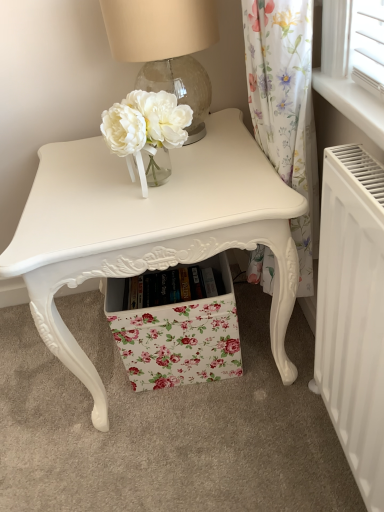
Question: Could matte white table at center be considered to be inside translucent glass table lamp at upper center?

Choices:
 (A) yes
 (B) no

Answer: (B)

Question: Does translucent glass table lamp at upper center lie behind matte white table at center?

Choices:
 (A) yes
 (B) no

Answer: (A)

Question: Is translucent glass table lamp at upper center oriented towards matte white table at center?

Choices:
 (A) no
 (B) yes

Answer: (A)

Question: Does translucent glass table lamp at upper center have a lesser height compared to matte white table at center?

Choices:
 (A) no
 (B) yes

Answer: (B)

Question: Is translucent glass table lamp at upper center with matte white table at center?

Choices:
 (A) no
 (B) yes

Answer: (A)

Question: Is point (311, 382) closer or farther from the camera than point (112, 28)?

Choices:
 (A) closer
 (B) farther

Answer: (B)

Question: Looking at their shapes, would you say white matte radiator at lower right is wider or thinner than translucent glass table lamp at upper center?

Choices:
 (A) thin
 (B) wide

Answer: (A)

Question: From their relative heights in the image, would you say white matte radiator at lower right is taller or shorter than translucent glass table lamp at upper center?

Choices:
 (A) tall
 (B) short

Answer: (A)

Question: Looking at the image, does white matte radiator at lower right seem bigger or smaller compared to translucent glass table lamp at upper center?

Choices:
 (A) big
 (B) small

Answer: (B)

Question: From a real-world perspective, is floral fabric drawer at center above or below matte white table at center?

Choices:
 (A) below
 (B) above

Answer: (A)

Question: From the image's perspective, is floral fabric drawer at center located above or below matte white table at center?

Choices:
 (A) above
 (B) below

Answer: (B)

Question: Which is correct: floral fabric drawer at center is inside matte white table at center, or outside of it?

Choices:
 (A) inside
 (B) outside

Answer: (A)

Question: From their relative heights in the image, would you say floral fabric drawer at center is taller or shorter than matte white table at center?

Choices:
 (A) short
 (B) tall

Answer: (A)

Question: From the image's perspective, relative to white matte radiator at lower right, is floral fabric drawer at center above or below?

Choices:
 (A) above
 (B) below

Answer: (A)

Question: Would you say floral fabric drawer at center is to the left or to the right of white matte radiator at lower right in the picture?

Choices:
 (A) right
 (B) left

Answer: (B)